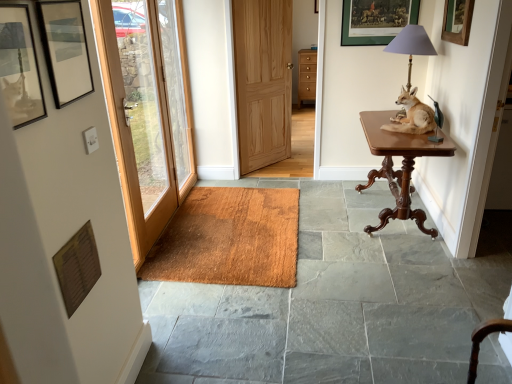
Locate an element on the screen. This screenshot has width=512, height=384. free spot to the right of brown textured mat at center is located at coordinates (364, 235).